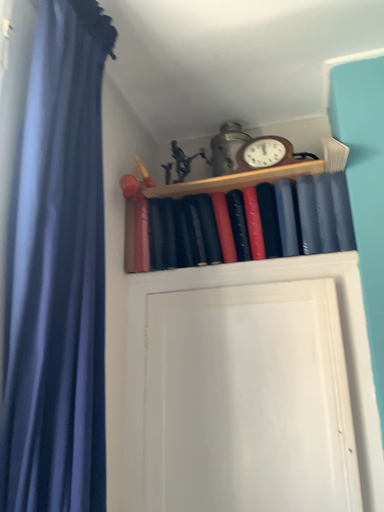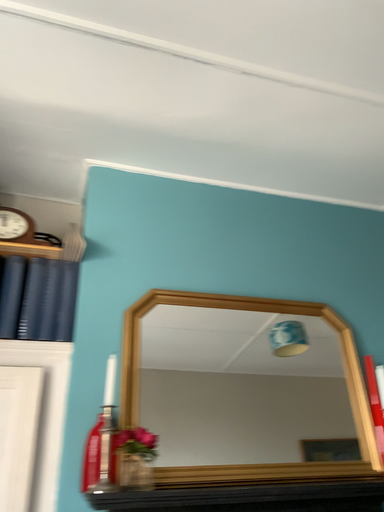
Question: Which way did the camera rotate in the video?

Choices:
 (A) rotated left
 (B) rotated right

Answer: (B)